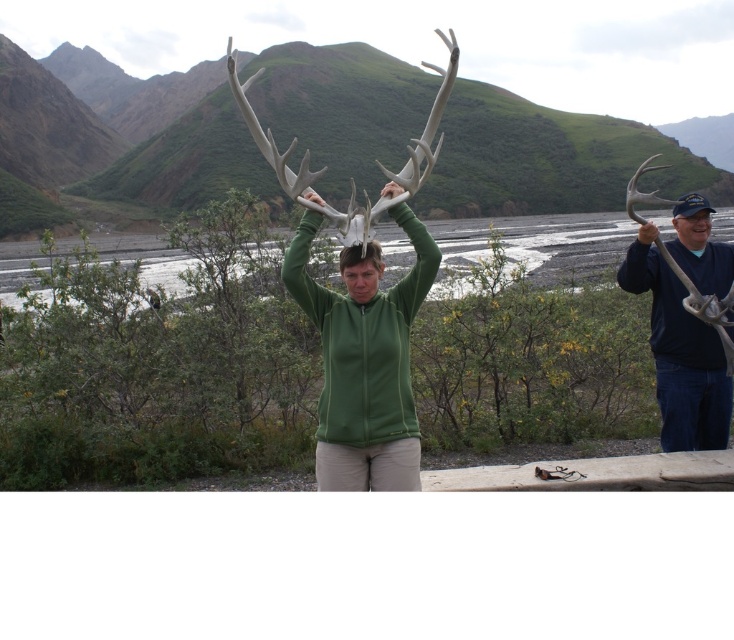
Is point (236, 93) positioned behind point (701, 232)?

No, (236, 93) is closer to viewer.

Between white matte antlers at center and matte black antlers at right, which one has less height?

With less height is matte black antlers at right.

Does point (330, 212) come in front of point (697, 211)?

Yes, it is.

This screenshot has height=640, width=734. I want to click on white matte antlers at center, so pos(349,177).

Is dark blue fabric antlers at right bigger than white matte antlers at center?

Actually, dark blue fabric antlers at right might be smaller than white matte antlers at center.

The height and width of the screenshot is (640, 734). Describe the element at coordinates (686, 317) in the screenshot. I see `dark blue fabric antlers at right` at that location.

Between point (664, 394) and point (437, 72), which one is positioned in front?

Positioned in front is point (664, 394).

The image size is (734, 640). I want to click on dark blue fabric antlers at right, so click(x=686, y=317).

Can you confirm if green matte deer antlers at center is positioned to the right of green matte jacket at center?

Indeed, green matte deer antlers at center is positioned on the right side of green matte jacket at center.

Does point (363, 356) lie in front of point (341, 269)?

Yes, point (363, 356) is in front of point (341, 269).

This screenshot has height=640, width=734. Describe the element at coordinates (363, 358) in the screenshot. I see `green matte deer antlers at center` at that location.

Where is `green matte deer antlers at center`? Image resolution: width=734 pixels, height=640 pixels. green matte deer antlers at center is located at coordinates (363, 358).